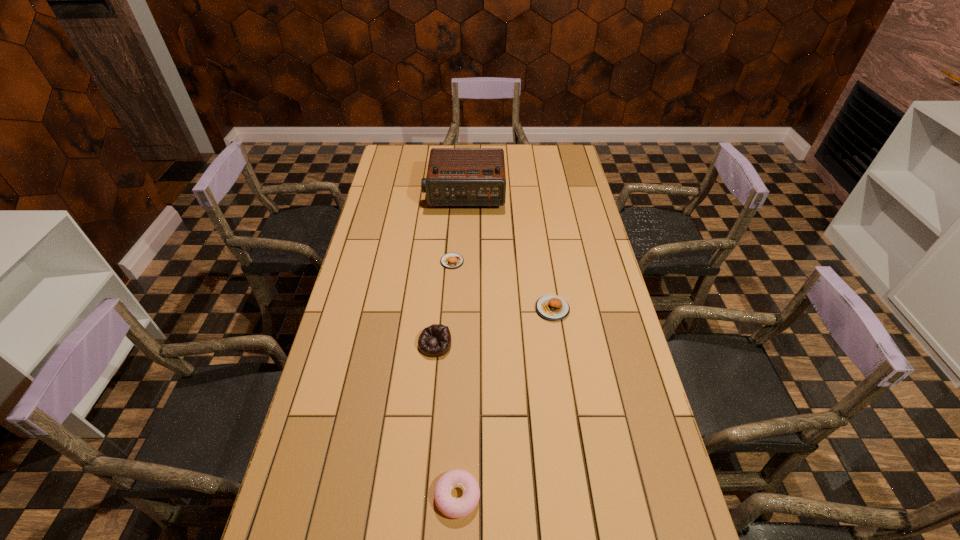
Identify the location of vacant position located on the left of the second farthest object. (358, 261).

The image size is (960, 540). In order to click on free region located 0.220m on the back of the rightmost object in this screenshot , I will do `click(543, 253)`.

Where is `free region located on the right of the nearest object`? free region located on the right of the nearest object is located at coordinates (522, 496).

At what (x,y) coordinates should I click in order to perform the action: click on object positioned at the right edge. Please return your answer as a coordinate pair (x, y). The height and width of the screenshot is (540, 960). Looking at the image, I should click on (551, 307).

Where is `vacant space at the far edge`? vacant space at the far edge is located at coordinates (481, 148).

You are a GUI agent. You are given a task and a screenshot of the screen. Output one action in this format:
    pyautogui.click(x=<x>, y=<y>)
    Task: Click on the free space at the left edge of the desktop
    This screenshot has width=960, height=540.
    Given the screenshot: What is the action you would take?
    pyautogui.click(x=361, y=381)

This screenshot has height=540, width=960. Find the location of `free space at the right edge`. free space at the right edge is located at coordinates (593, 298).

Identify the location of vacant area that lies between the farther food and the beanbag. The height and width of the screenshot is (540, 960). (444, 303).

At what (x,y) coordinates should I click in order to perform the action: click on vacant space that's between the doughnut and the rightmost object. Please return your answer as a coordinate pair (x, y). Looking at the image, I should click on (505, 402).

Where is `vacant space in between the third nearest object and the left food`? This screenshot has width=960, height=540. vacant space in between the third nearest object and the left food is located at coordinates (502, 285).